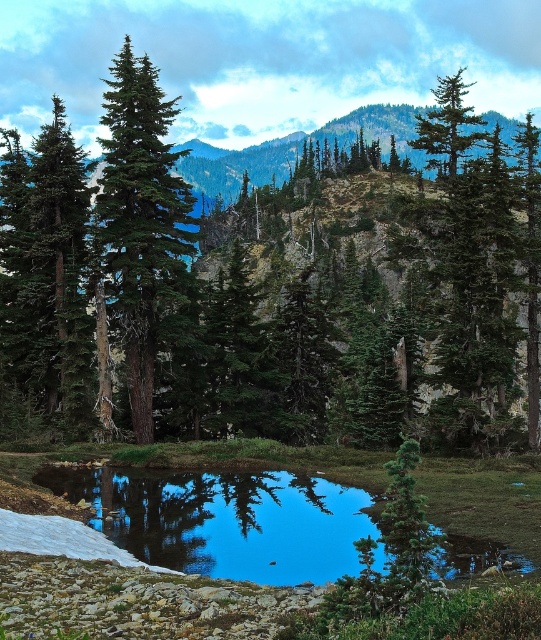
Question: Considering the relative positions of clear glass water at center and green matte evergreen tree at upper center in the image provided, where is clear glass water at center located with respect to green matte evergreen tree at upper center?

Choices:
 (A) below
 (B) above

Answer: (A)

Question: Which point is farther to the camera?

Choices:
 (A) tap(114, 170)
 (B) tap(452, 150)

Answer: (A)

Question: From the image, what is the correct spatial relationship of clear glass water at center in relation to green matte tree at left?

Choices:
 (A) left
 (B) right

Answer: (B)

Question: Which object is the closest to the green matte tree at left?

Choices:
 (A) green matte tree at center
 (B) green matte evergreen tree at upper center
 (C) clear glass water at center

Answer: (A)

Question: Considering the real-world distances, which object is farthest from the clear glass water at center?

Choices:
 (A) green matte tree at center
 (B) green matte evergreen tree at upper center
 (C) green matte tree at left

Answer: (B)

Question: Can you confirm if green matte tree at left is wider than green matte evergreen tree at upper center?

Choices:
 (A) no
 (B) yes

Answer: (A)